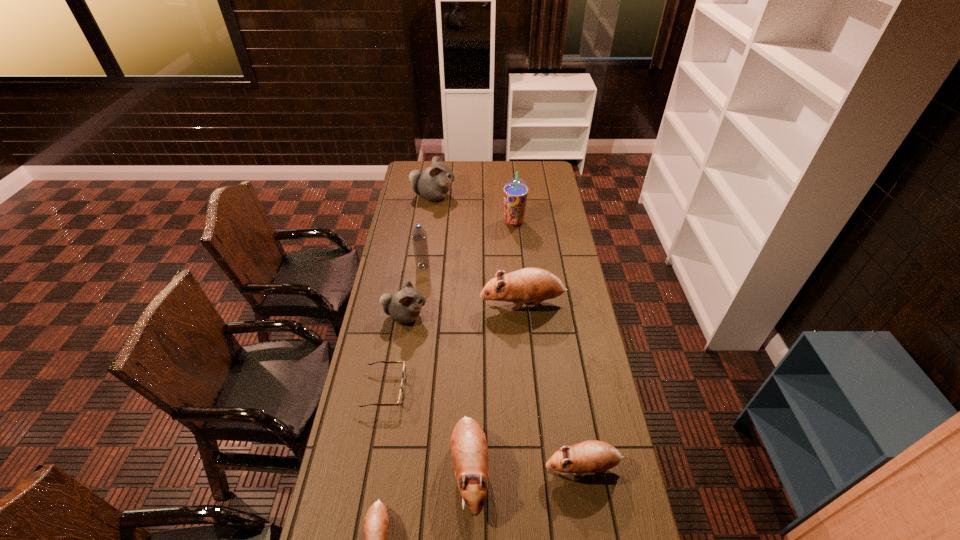
At what (x,y) coordinates should I click in order to perform the action: click on the third shortest object. Please return your answer as a coordinate pair (x, y). The height and width of the screenshot is (540, 960). Looking at the image, I should click on 591,456.

Where is `spectacles`? The height and width of the screenshot is (540, 960). spectacles is located at coordinates (400, 400).

Identify the location of the sixth farthest object. (400, 400).

Find the location of `free location located on the right of the second farthest object`. free location located on the right of the second farthest object is located at coordinates (538, 222).

Locate an element on the screen. This screenshot has width=960, height=540. vacant area situated on the front of the blue water bottle is located at coordinates (419, 294).

Image resolution: width=960 pixels, height=540 pixels. Identify the location of blank space located 0.150m on the face of the farthest object. 483,196.

Identify the location of free point located 0.370m at the face of the biggest brown hamster. The image size is (960, 540). pos(392,303).

At what (x,y) coordinates should I click in order to perform the action: click on vacant region located at the face of the biggest brown hamster. Please return your answer as a coordinate pair (x, y). This screenshot has width=960, height=540. Looking at the image, I should click on (432, 303).

Find the location of a particular element. The image size is (960, 540). vacant space situated at the face of the biggest brown hamster is located at coordinates (411, 303).

Find the location of a particular element. The width and height of the screenshot is (960, 540). free spot located 0.340m on the face of the nearer white hamster is located at coordinates (511, 316).